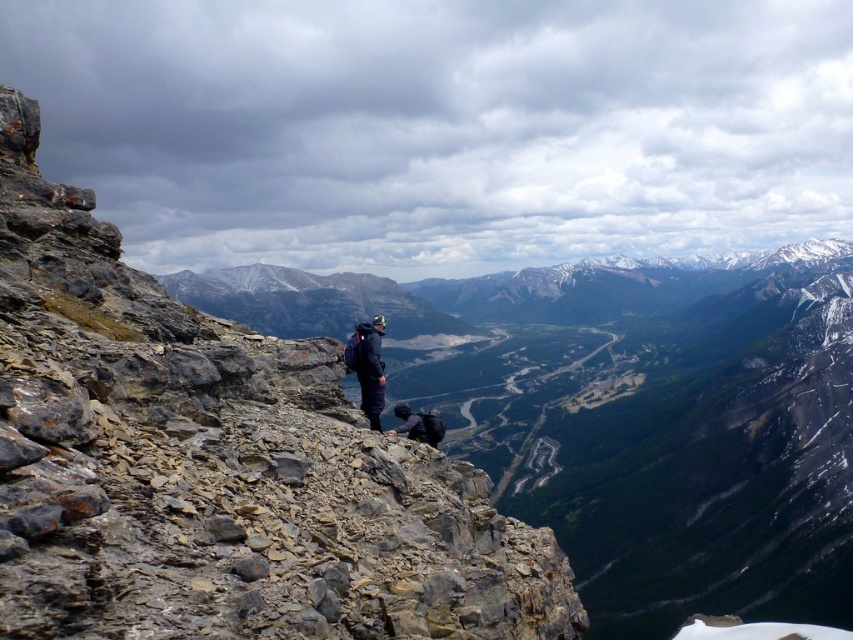
You are a hiker trying to locate your backpack in the rocky terrain. You see the dark blue fabric jacket at center and the dark blue fabric backpack at center. Which object is nearer to you?

The dark blue fabric jacket at center is closer to the viewer than the dark blue fabric backpack at center.

You are a hiker who wants to ensure your gear is properly packed. Looking at the dark blue fabric jacket at center and the dark blue fabric backpack at center, which item takes up more space?

The dark blue fabric backpack at center takes up more space than the dark blue fabric jacket at center, so the backpack occupies more space.